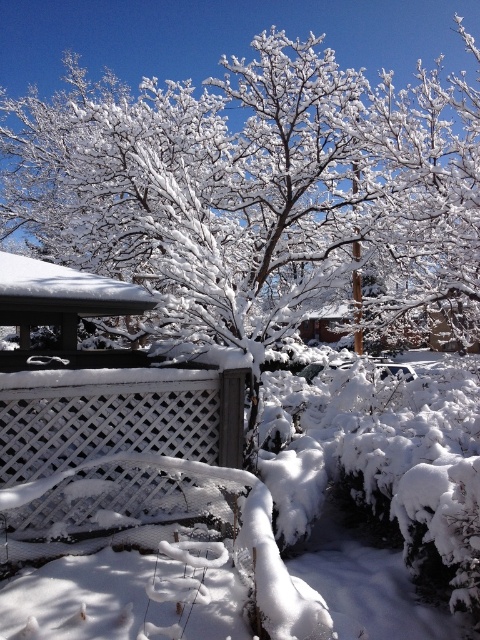
Is white frosty tree at center below white lattice fence at center?

Actually, white frosty tree at center is above white lattice fence at center.

Which is more to the left, white frosty tree at center or white lattice fence at center?

white lattice fence at center

Is point (74, 88) behind point (71, 476)?

That is True.

Image resolution: width=480 pixels, height=640 pixels. In order to click on white frosty tree at center in this screenshot , I will do `click(254, 189)`.